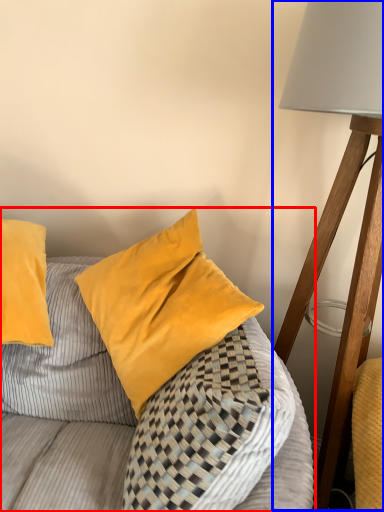
Question: Which point is further to the camera, furniture (highlighted by a red box) or lamp (highlighted by a blue box)?

Choices:
 (A) furniture
 (B) lamp

Answer: (B)